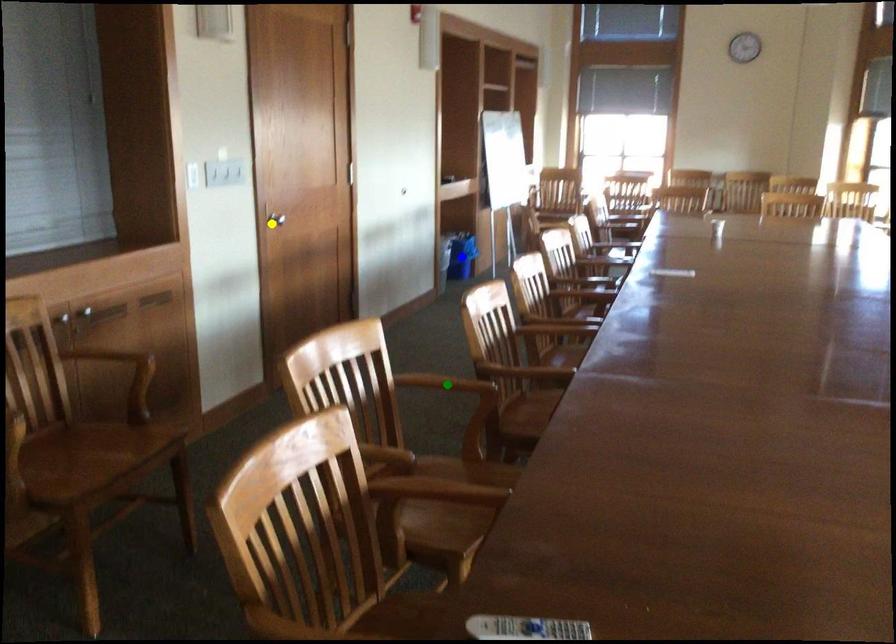
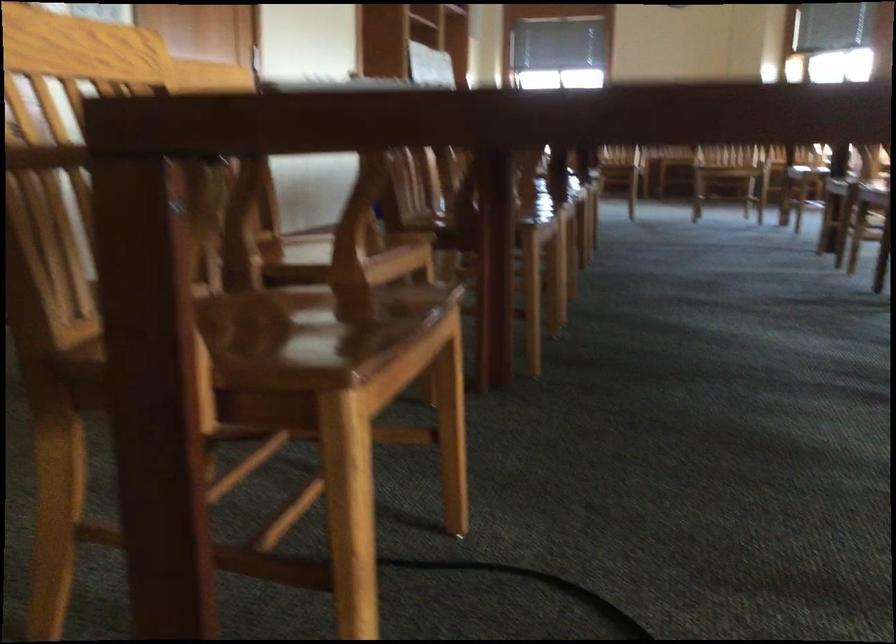
I am providing you with two images of the same scene from different viewpoints. Three points are marked in image1. Which point corresponds to a part or object that is occluded in image2?In image1, three points are marked. Which of them correspond to a part or object that is occluded in image2?Among the three points shown in image1, which one corresponds to a part or object that is no longer visible due to occlusion in image2?

yellow point, blue point, green point